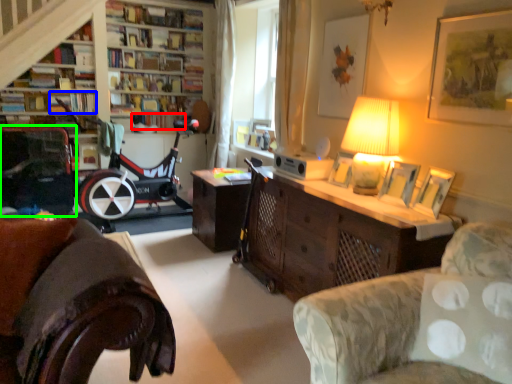
Question: Which is nearer to the book (highlighted by a red box)? book (highlighted by a blue box) or armchair (highlighted by a green box).

Choices:
 (A) book
 (B) armchair

Answer: (A)